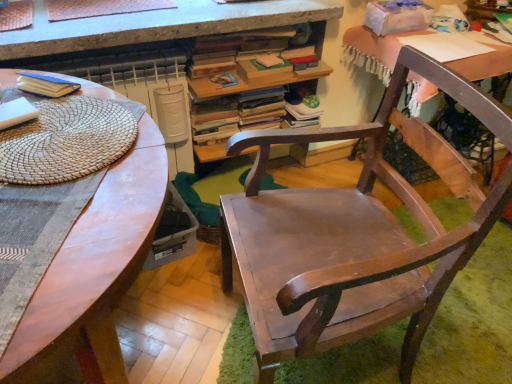
You are a GUI agent. You are given a task and a screenshot of the screen. Output one action in this format:
    pyautogui.click(x=<x>, y=<y>)
    Task: Click on the vacant area that is in front of matte blue paperback book at upper left
    The image size is (512, 384).
    Given the screenshot: What is the action you would take?
    pyautogui.click(x=51, y=109)